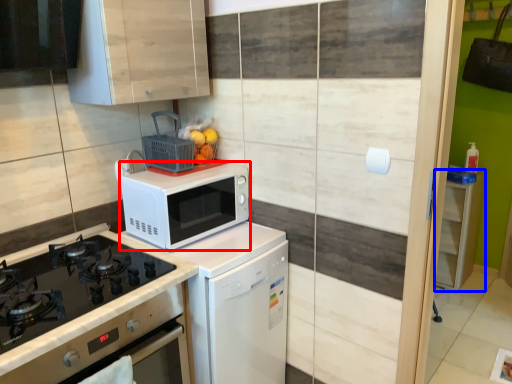
Question: Which object is closer to the camera taking this photo, microwave oven (highlighted by a red box) or cabinetry (highlighted by a blue box)?

Choices:
 (A) microwave oven
 (B) cabinetry

Answer: (A)